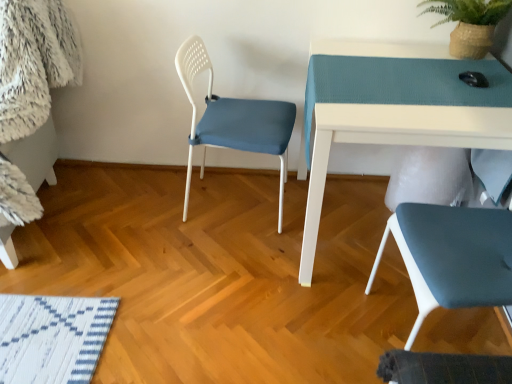
Where is `vacant space that is in between white plastic chair at center, which is the second chair from right to left, and white glossy table at upper right`? The image size is (512, 384). vacant space that is in between white plastic chair at center, which is the second chair from right to left, and white glossy table at upper right is located at coordinates (250, 243).